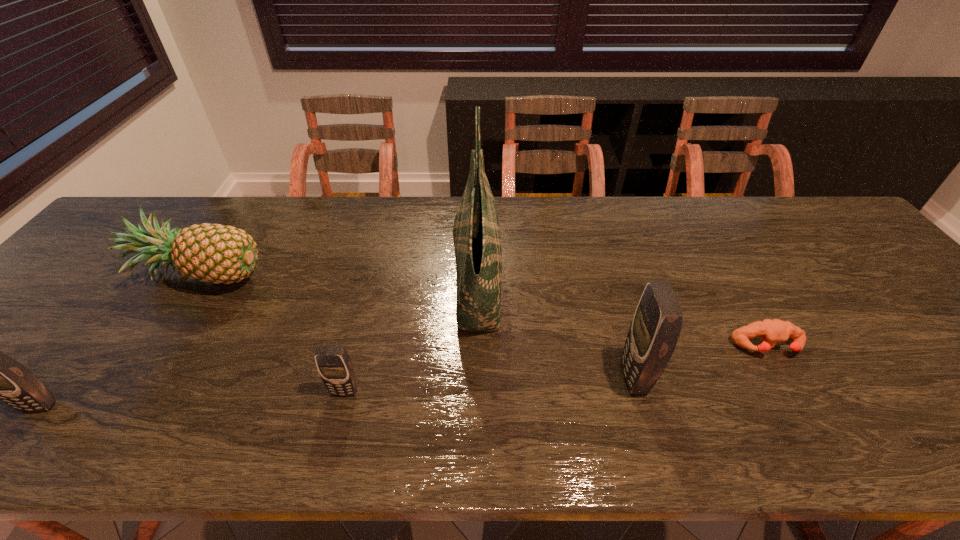
Please point out where to position a new cellular telephone on the right to maintain spacing. Please provide its 2D coordinates. Your answer should be formatted as a tuple, i.e. [(x, y)], where the tuple contains the x and y coordinates of a point satisfying the conditions above.

[(909, 365)]